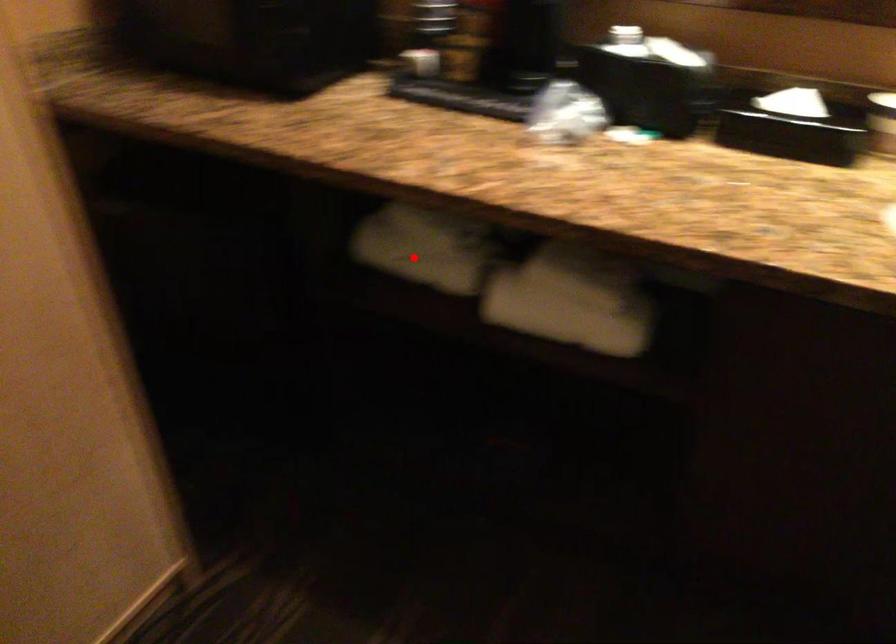
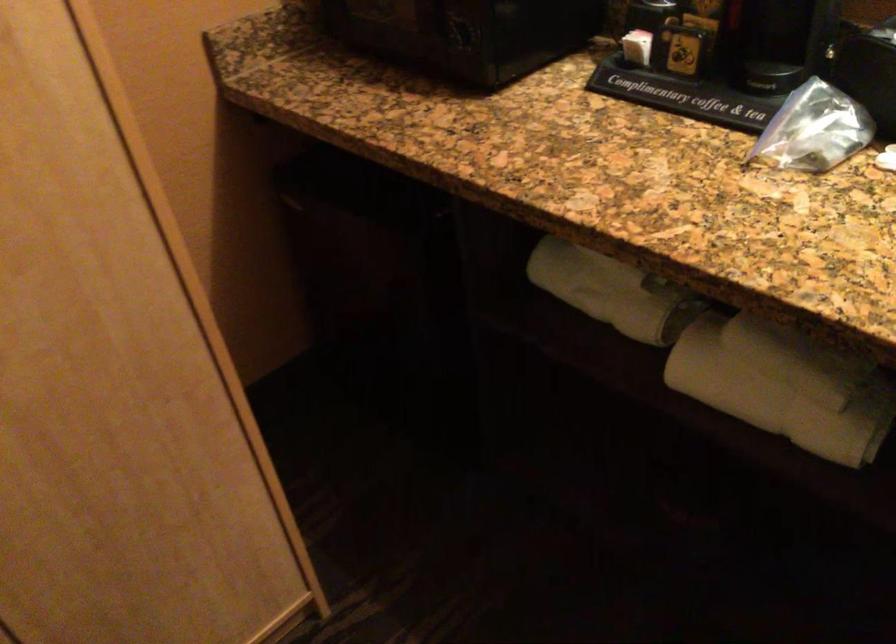
The point at the highlighted location is marked in the first image. Where is the corresponding point in the second image?

(596, 290)